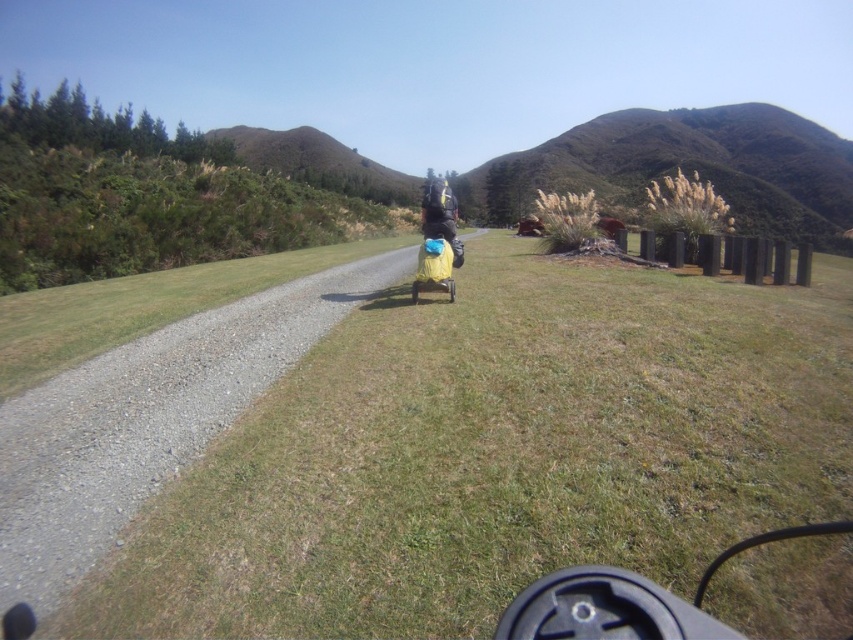
Consider the image. You are a hiker trying to place a 10 feet long tent between the green grassy at center and the matte black backpack at center. Can you fit the tent between them without moving either object?

The distance between the green grassy at center and the matte black backpack at center is 9.87 feet. Since the tent is 10 feet long, it cannot fit between them without moving either object.